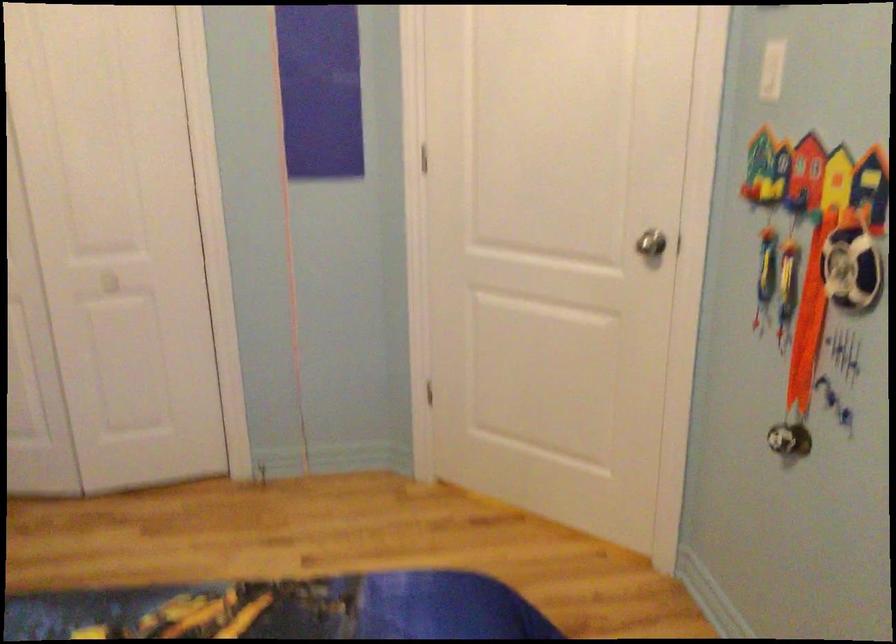
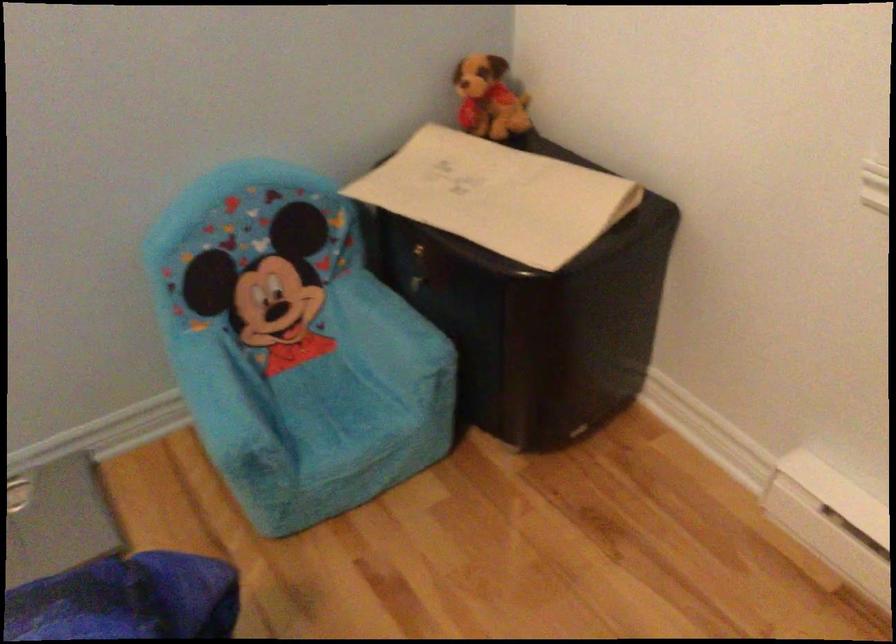
How did the camera likely rotate?

The rotation direction of the camera is right-down.